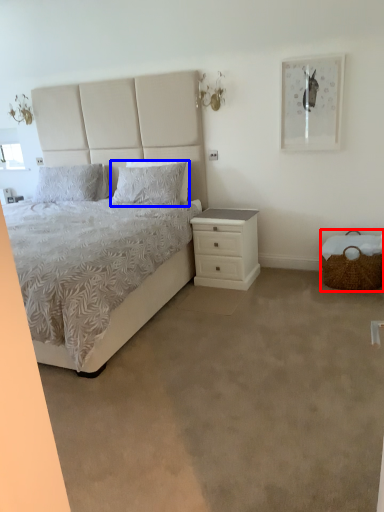
Question: Among these objects, which one is farthest to the camera, basket (highlighted by a red box) or pillow (highlighted by a blue box)?

Choices:
 (A) basket
 (B) pillow

Answer: (B)